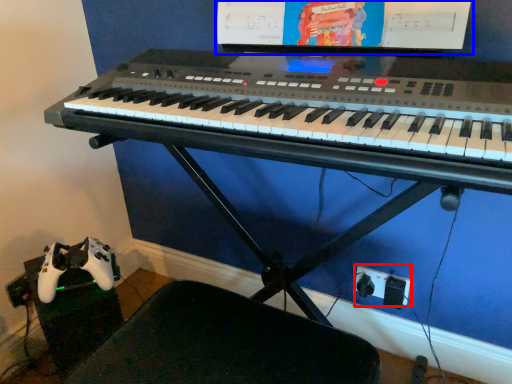
Question: Which object is further to the camera taking this photo, plug (highlighted by a red box) or computer monitor (highlighted by a blue box)?

Choices:
 (A) plug
 (B) computer monitor

Answer: (A)